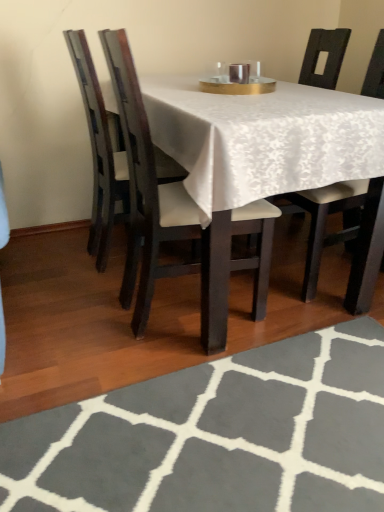
Identify the location of vacant space situated on the left part of dark wood chair at center, the second chair positioned from the left. This screenshot has width=384, height=512. (70, 315).